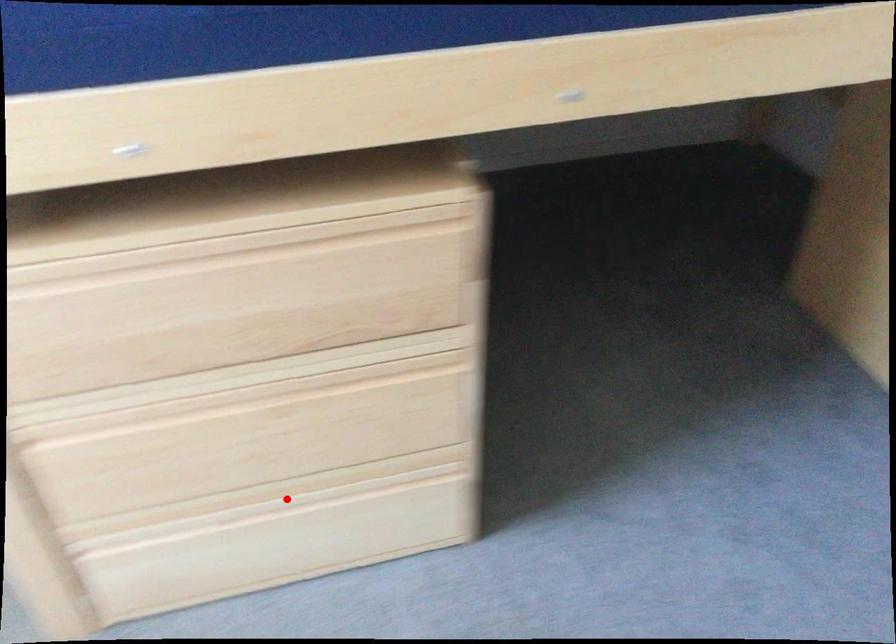
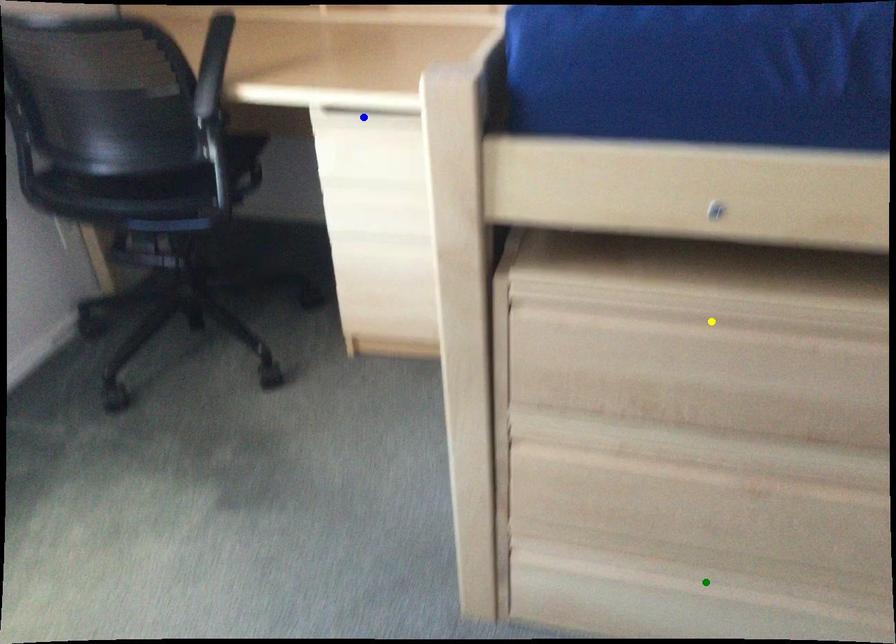
Question: I am providing you with two images of the same scene from different viewpoints. A red point is marked on the first image. You are given multiple points on the second image. Which mark in image 2 goes with the point in image 1?

Choices:
 (A) green point
 (B) blue point
 (C) yellow point

Answer: (A)